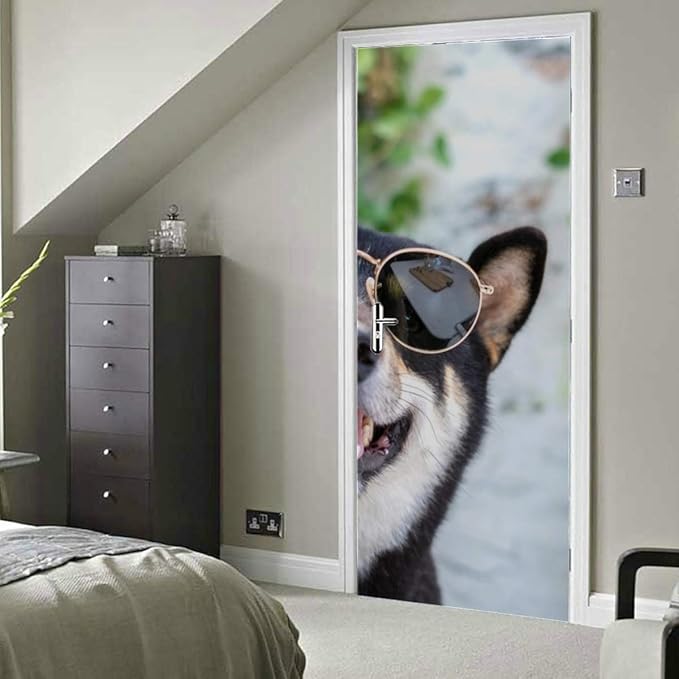
Image resolution: width=679 pixels, height=679 pixels. I want to click on tall thin chest of drawers, so click(151, 388), click(143, 299), click(117, 443).